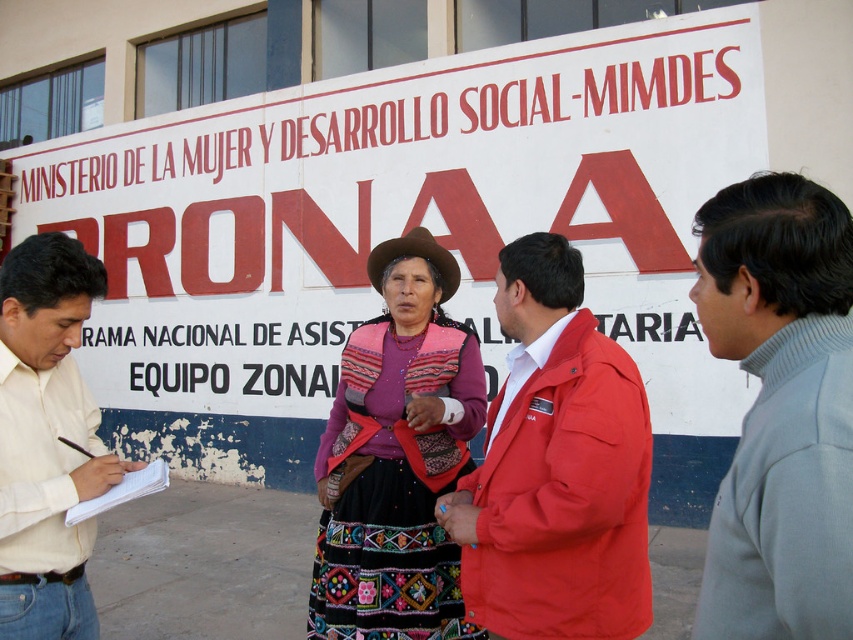
Question: Which point is farther to the camera?

Choices:
 (A) (90, 529)
 (B) (805, 358)
 (C) (440, 291)
 (D) (613, 432)

Answer: (C)

Question: Can you confirm if white paperboard sign at center is positioned below brown felt cowboy hat at center?

Choices:
 (A) no
 (B) yes

Answer: (A)

Question: Does gray turtleneck sweater at right appear on the right side of embroidered fabric dress at center?

Choices:
 (A) no
 (B) yes

Answer: (B)

Question: Which object is the closest to the light yellow shirt at left?

Choices:
 (A) brown felt cowboy hat at center
 (B) embroidered fabric dress at center
 (C) gray turtleneck sweater at right
 (D) white paperboard sign at center

Answer: (B)

Question: Is matte red jacket at center wider than light yellow shirt at left?

Choices:
 (A) no
 (B) yes

Answer: (B)

Question: Which of these objects is positioned farthest from the gray turtleneck sweater at right?

Choices:
 (A) matte red jacket at center
 (B) white paperboard sign at center
 (C) embroidered fabric dress at center

Answer: (B)